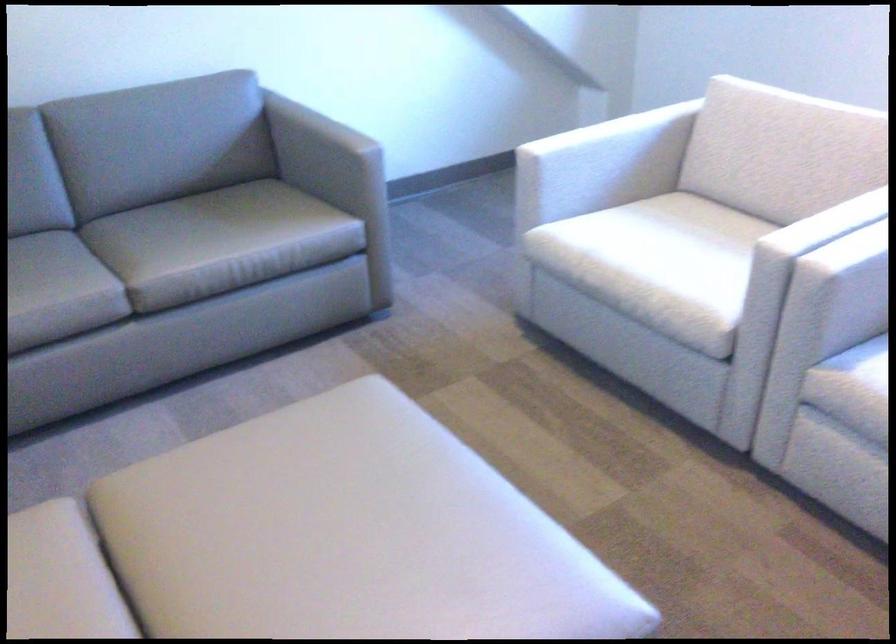
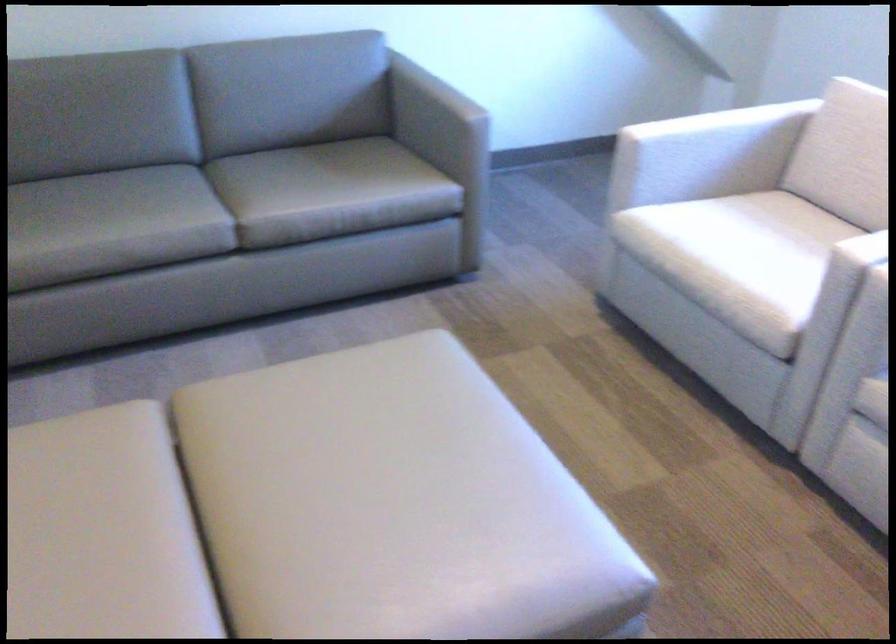
The point at (x=300, y=524) is marked in the first image. Where is the corresponding point in the second image?

(348, 446)